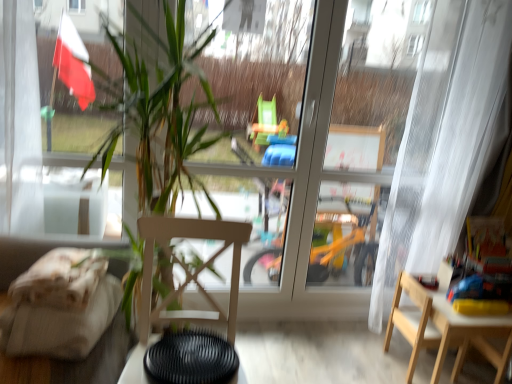
Question: Is beige fabric couch at left positioned beyond the bounds of wooden chair at center, which is counted as the second chair, starting from the right?

Choices:
 (A) yes
 (B) no

Answer: (A)

Question: Is beige fabric couch at left bigger than wooden chair at center, placed as the second chair when sorted from back to front?

Choices:
 (A) yes
 (B) no

Answer: (B)

Question: Is beige fabric couch at left positioned with its back to wooden chair at center, which is counted as the second chair, starting from the right?

Choices:
 (A) no
 (B) yes

Answer: (A)

Question: Is beige fabric couch at left smaller than wooden chair at center, acting as the first chair starting from the front?

Choices:
 (A) yes
 (B) no

Answer: (A)

Question: Is there a large distance between beige fabric couch at left and wooden chair at center, marked as the first chair in a left-to-right arrangement?

Choices:
 (A) yes
 (B) no

Answer: (B)

Question: In terms of width, does black matte table at lower center, positioned as the first table in front-to-back order, look wider or thinner when compared to wooden chair at center, which is counted as the second chair, starting from the right?

Choices:
 (A) thin
 (B) wide

Answer: (A)

Question: Considering the positions of black matte table at lower center, positioned as the first table in front-to-back order, and wooden chair at center, which is counted as the second chair, starting from the right, in the image, is black matte table at lower center, positioned as the first table in front-to-back order, bigger or smaller than wooden chair at center, which is counted as the second chair, starting from the right,?

Choices:
 (A) small
 (B) big

Answer: (A)

Question: Does point (244, 372) appear closer or farther from the camera than point (145, 304)?

Choices:
 (A) closer
 (B) farther

Answer: (B)

Question: From the image's perspective, is black matte table at lower center, which is counted as the second table, starting from the right, above or below wooden chair at center, placed as the second chair when sorted from back to front?

Choices:
 (A) below
 (B) above

Answer: (A)

Question: Choose the correct answer: Is green leafy plant at center inside light wood chair at lower right, the 1th chair positioned from the back, or outside it?

Choices:
 (A) inside
 (B) outside

Answer: (B)

Question: Visually, is green leafy plant at center positioned to the left or to the right of light wood chair at lower right, the 1th chair when ordered from right to left?

Choices:
 (A) right
 (B) left

Answer: (B)

Question: Considering their positions, is green leafy plant at center located in front of or behind light wood chair at lower right, the 1th chair when ordered from right to left?

Choices:
 (A) behind
 (B) front

Answer: (B)

Question: From the image's perspective, is green leafy plant at center positioned above or below light wood chair at lower right, the 1th chair when ordered from right to left?

Choices:
 (A) above
 (B) below

Answer: (A)

Question: Choose the correct answer: Is light wood chair at lower right, the 1th chair when ordered from right to left, inside white sheer curtain at right or outside it?

Choices:
 (A) outside
 (B) inside

Answer: (A)

Question: Based on their sizes in the image, would you say light wood chair at lower right, the 1th chair when ordered from right to left, is bigger or smaller than white sheer curtain at right?

Choices:
 (A) big
 (B) small

Answer: (B)